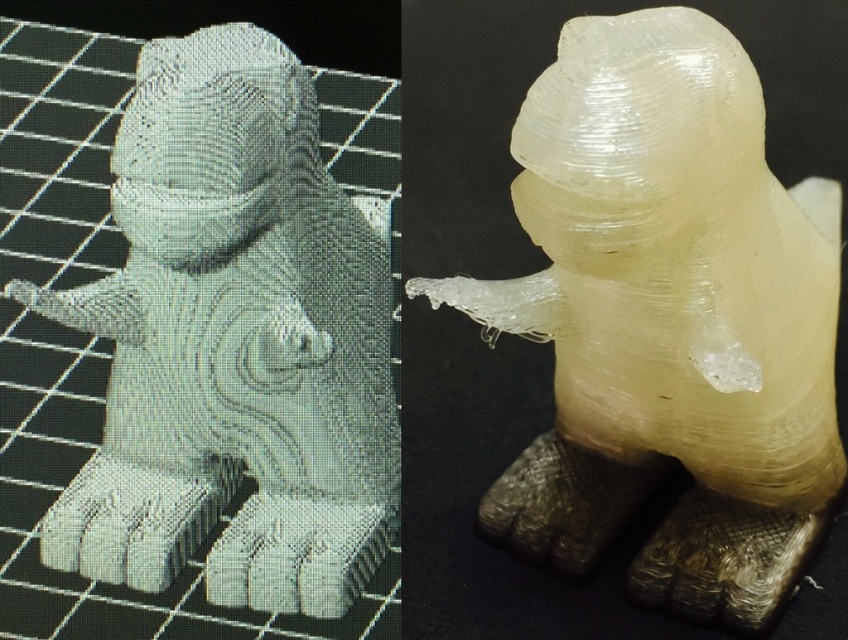
Is translucent white sculpture at center to the right of white glossy statue at center from the viewer's perspective?

Yes, translucent white sculpture at center is to the right of white glossy statue at center.

Is translucent white sculpture at center positioned in front of white glossy statue at center?

Yes, translucent white sculpture at center is closer to the viewer.

Image resolution: width=848 pixels, height=640 pixels. In order to click on translucent white sculpture at center in this screenshot , I will do `click(668, 320)`.